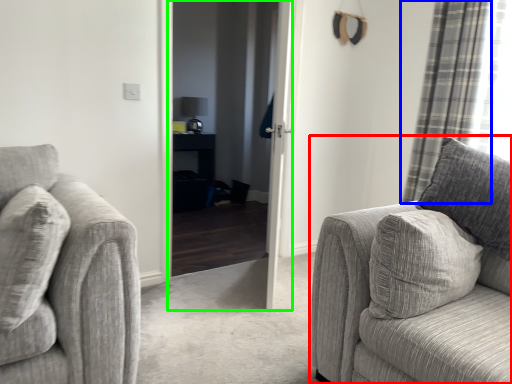
Question: Which object is positioned closest to studio couch (highlighted by a red box)? Select from curtain (highlighted by a blue box) and screen door (highlighted by a green box).

Choices:
 (A) curtain
 (B) screen door

Answer: (A)